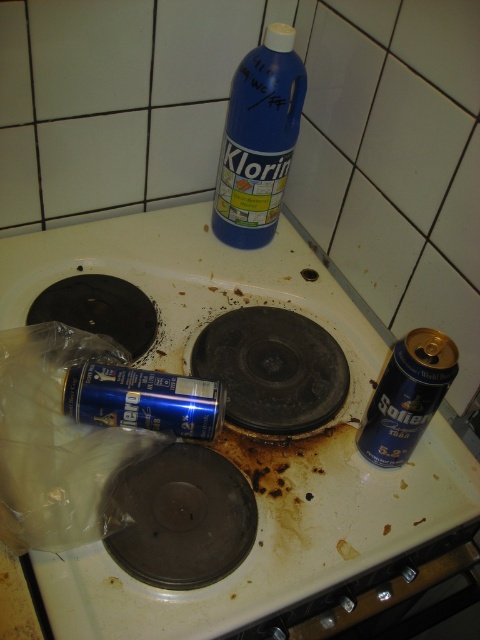
Consider the image. You are a cleaning assistant who needs to place a 30 cm long tool between the blue metallic can at center and the blue plastic bottle at upper center on the stove. Will there be enough space?

The blue metallic can at center and blue plastic bottle at upper center are 25.61 centimeters apart from each other. Since the tool is 30 cm long, it will not fit between them as the distance is shorter than the tool.